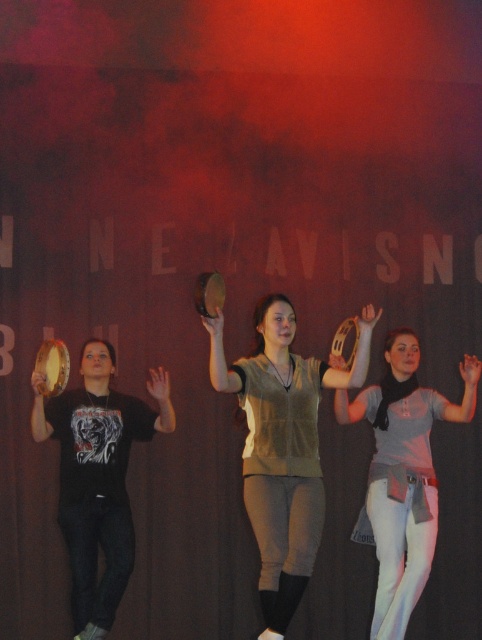
Based on the scene description, which clothing item at the center of the stage has a greater width when comparing the velvet beige vest at center and the light gray cotton shirt at center?

The velvet beige vest at center has a greater width than the light gray cotton shirt at center according to the description.

Based on the photo, what is located at the coordinate point (x=282, y=445) on the stage?

The velvet beige vest at center is located at the coordinate point (x=282, y=445) on the stage.